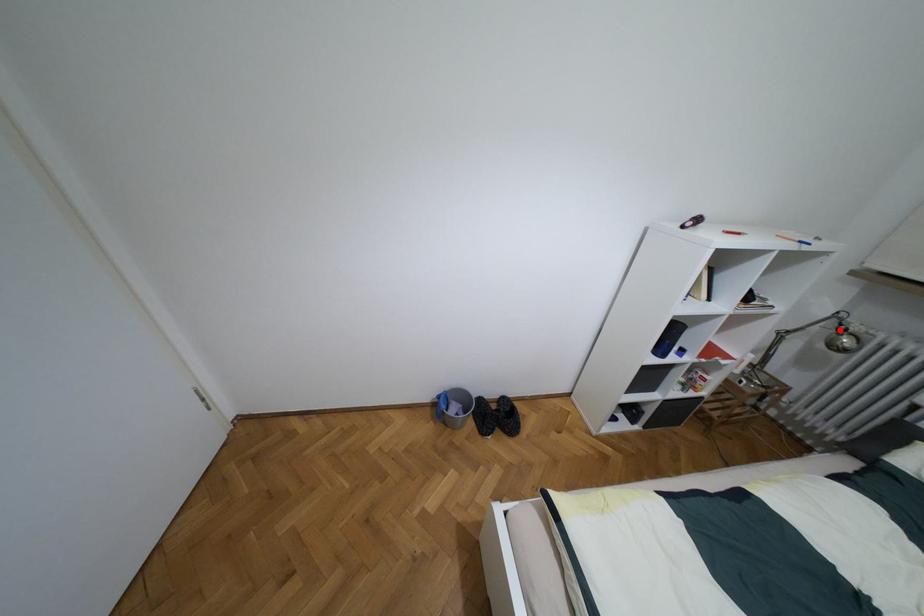
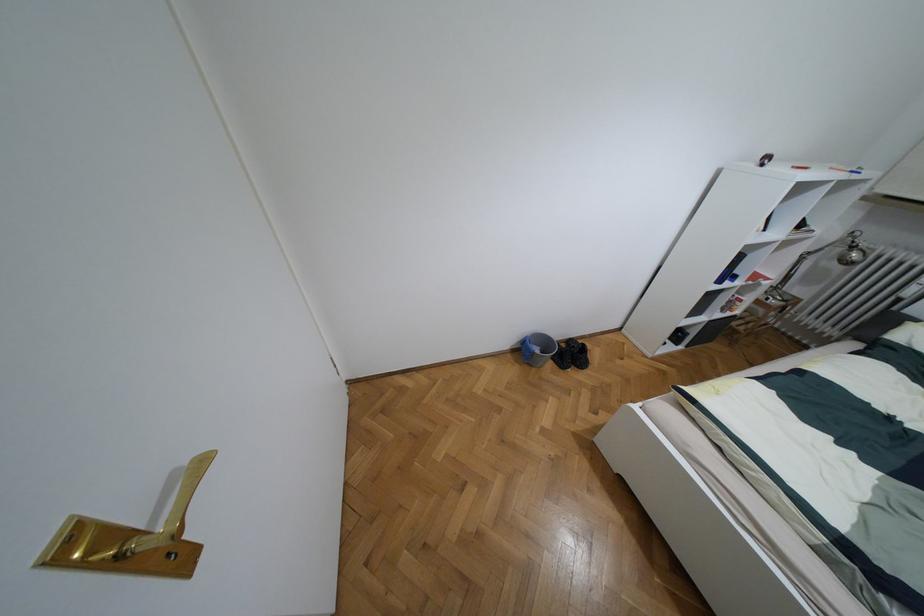
Where in the second image is the point corresponding to the highlighted location from the first image?

(852, 246)